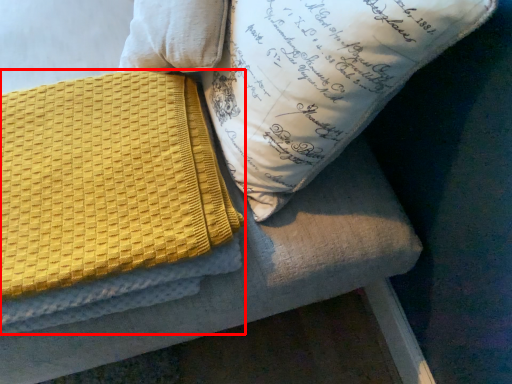
Question: From the image's perspective, where is blanket (annotated by the red box) located in relation to pillow in the image?

Choices:
 (A) below
 (B) above

Answer: (A)